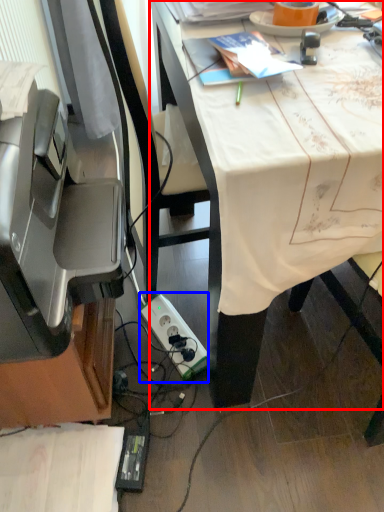
Question: Which object appears closest to the camera in this image, desk (highlighted by a red box) or power plugs and sockets (highlighted by a blue box)?

Choices:
 (A) desk
 (B) power plugs and sockets

Answer: (A)